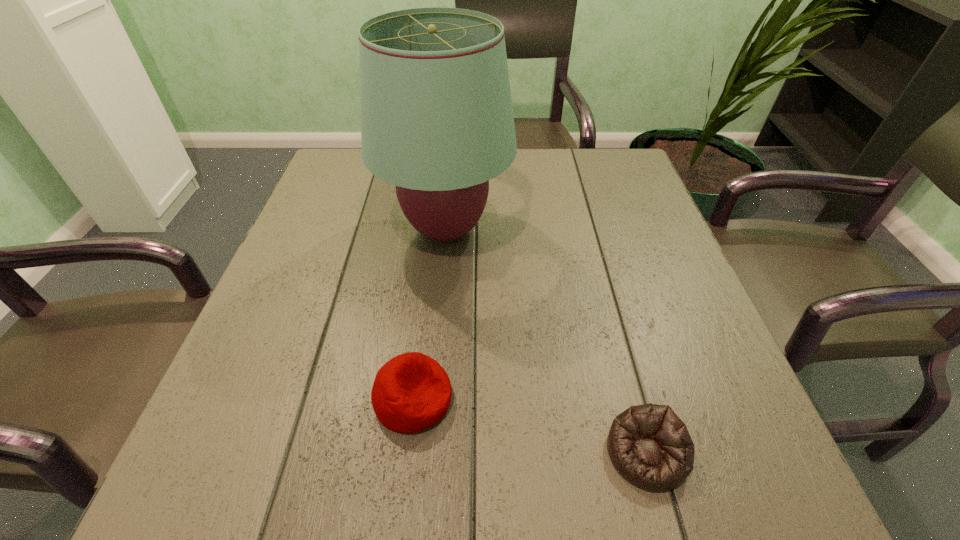
Where is `object located in the near edge section of the desktop`? object located in the near edge section of the desktop is located at coordinates (649, 445).

Locate an element on the screen. The image size is (960, 540). object positioned at the right edge is located at coordinates (649, 445).

This screenshot has width=960, height=540. I want to click on object located at the near right corner, so click(x=649, y=445).

Locate an element on the screen. vacant area at the far edge of the desktop is located at coordinates (524, 164).

Find the location of a particular element. The image size is (960, 540). vacant region at the near edge is located at coordinates (604, 455).

Locate an element on the screen. The height and width of the screenshot is (540, 960). free space at the left edge of the desktop is located at coordinates (313, 262).

This screenshot has width=960, height=540. Find the location of `vacant space at the right edge`. vacant space at the right edge is located at coordinates (689, 301).

In the image, there is a desktop. Identify the location of free region at the near left corner. This screenshot has height=540, width=960. pos(290,455).

In the image, there is a desktop. In order to click on vacant space at the far right corner in this screenshot , I will do `click(601, 175)`.

You are a GUI agent. You are given a task and a screenshot of the screen. Output one action in this format:
    pyautogui.click(x=<x>, y=<y>)
    Task: Click on the free space between the tallest object and the second tallest object
    The height and width of the screenshot is (540, 960).
    Given the screenshot: What is the action you would take?
    pyautogui.click(x=429, y=314)